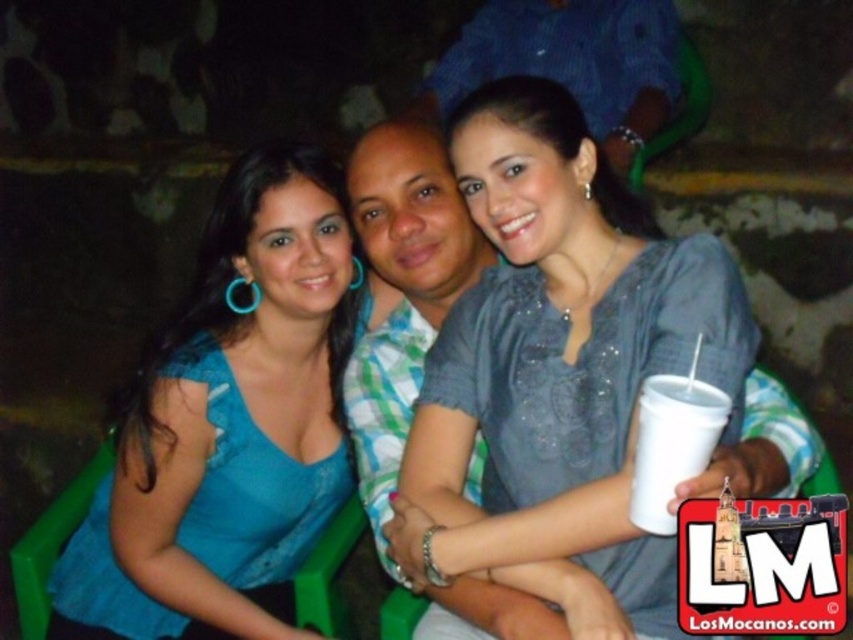
You are a photographer adjusting the camera focus. The blue fabric top at center and the white styrofoam cup at lower right are both in the frame. Which object should you focus on first if you want to ensure the taller one is sharp?

The blue fabric top at center is much taller than the white styrofoam cup at lower right, so you should focus on the blue fabric top at center first to ensure it is sharp.

Based on the photo, you are a photographer trying to focus on the blue fabric top at center and the white styrofoam cup at lower right. Which object is closer to the camera?

The blue fabric top at center is positioned over the white styrofoam cup at lower right, so it is closer to the camera.

You are at a nighttime event and see the gray matte shirt at center and the white styrofoam cup at lower right. Which object is located more to the left side?

The gray matte shirt at center is positioned on the left side of the white styrofoam cup at lower right, so the gray matte shirt at center is more to the left.